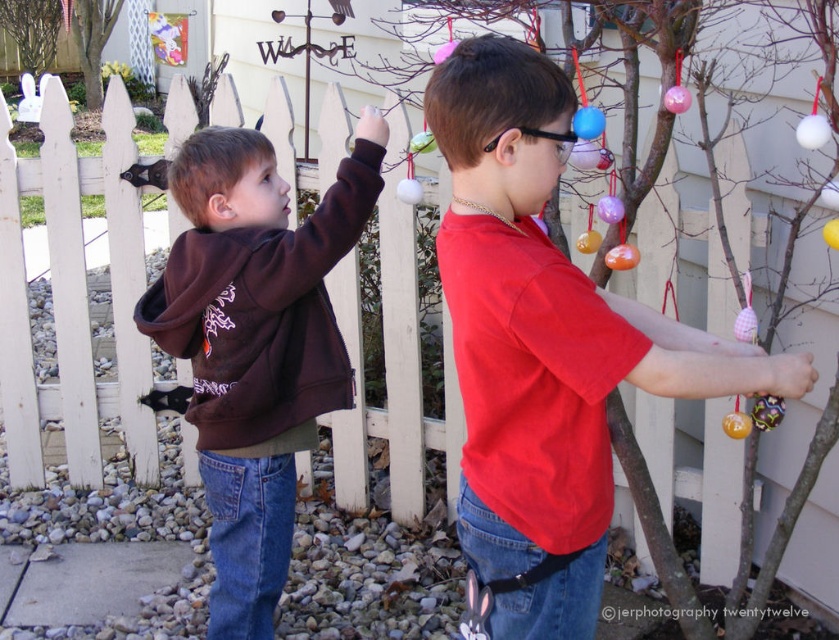
Is matte red shirt at center shorter than matte brown hoodie at left?

Indeed, matte red shirt at center has a lesser height compared to matte brown hoodie at left.

Is point (506, 518) in front of point (379, 132)?

Yes, point (506, 518) is in front of point (379, 132).

Measure the distance between matte red shirt at center and camera.

They are 1.42 meters apart.

The height and width of the screenshot is (640, 839). Identify the location of matte red shirt at center. (545, 346).